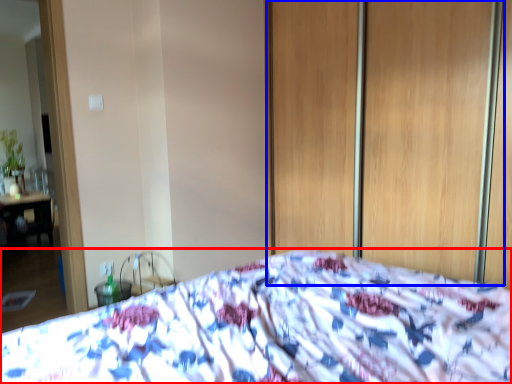
Question: Which object is further to the camera taking this photo, bed (highlighted by a red box) or screen door (highlighted by a blue box)?

Choices:
 (A) bed
 (B) screen door

Answer: (B)